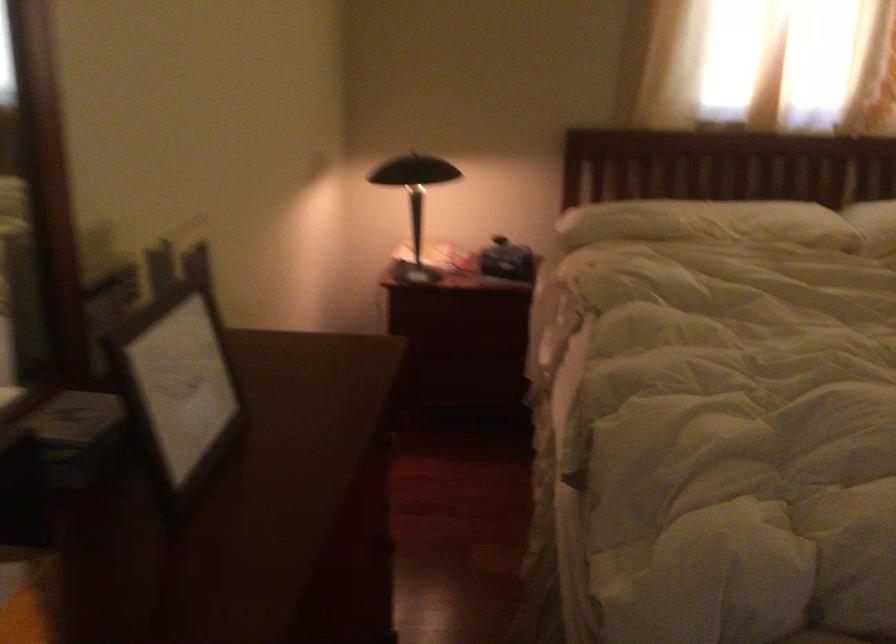
Where is `white picture frame`? white picture frame is located at coordinates (177, 386).